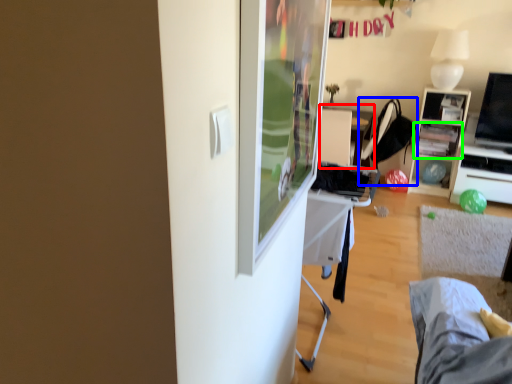
Question: Estimate the real-world distances between objects in this image. Which object is farther from table (highlighted by a red box), chair (highlighted by a blue box) or shelf (highlighted by a green box)?

Choices:
 (A) chair
 (B) shelf

Answer: (B)